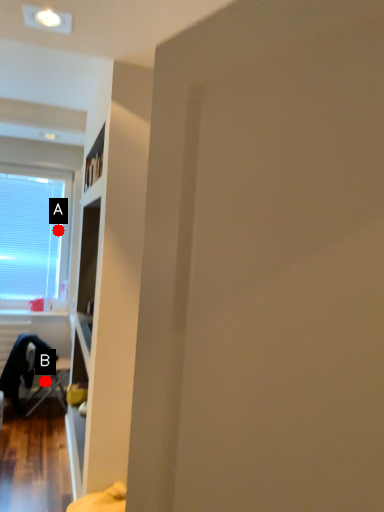
Question: Two points are circled on the image, labeled by A and B beside each circle. Which point is closer to the camera?

Choices:
 (A) A is closer
 (B) B is closer

Answer: (B)